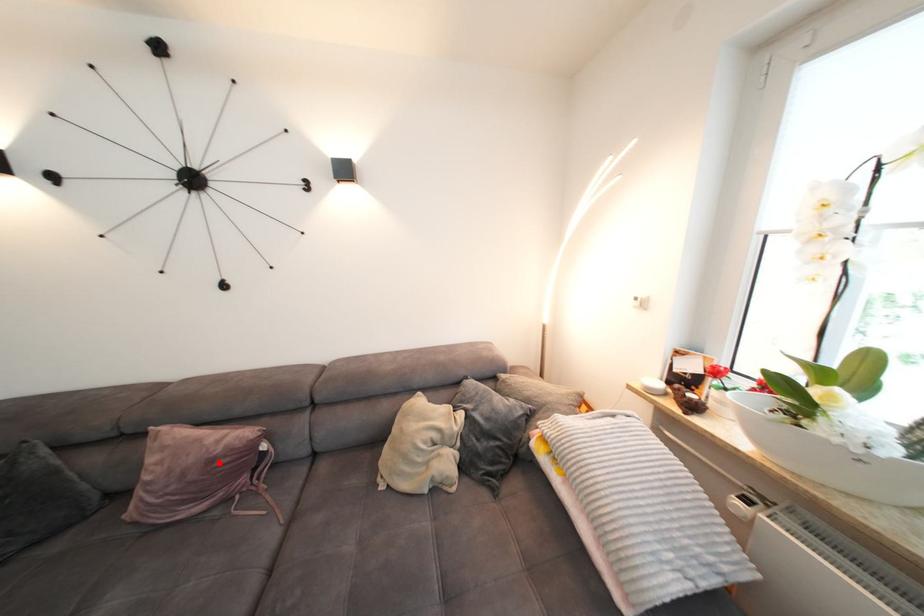
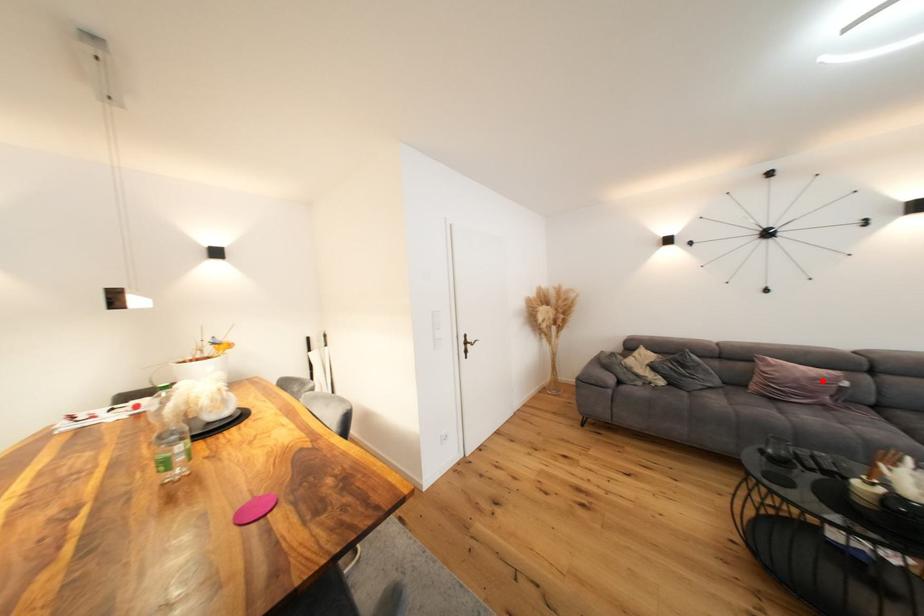
I am providing you with two images of the same scene from different viewpoints. A red point is marked on the first image and another point is marked on the second image. Is the red point in image1 aligned with the point shown in image2?

Yes